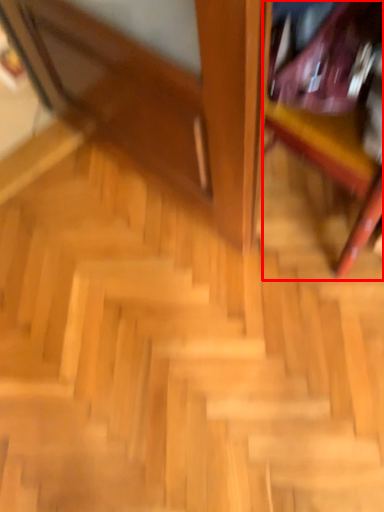
Question: From the image's perspective, what is the correct spatial positioning of furniture (annotated by the red box) in reference to stairs?

Choices:
 (A) above
 (B) below

Answer: (A)